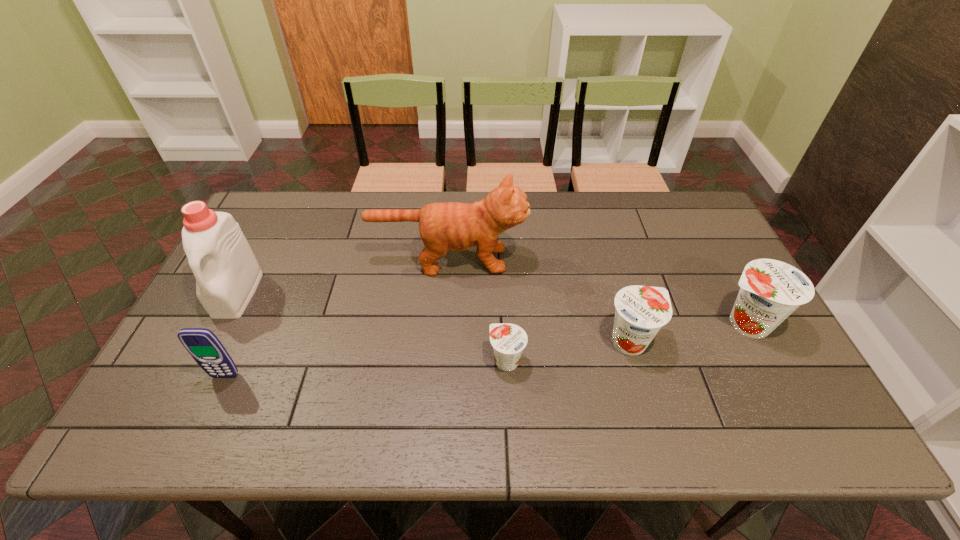
Locate an element on the screen. The height and width of the screenshot is (540, 960). unoccupied area between the cellular telephone and the detergent is located at coordinates (231, 335).

Where is `free spot between the rightmost yogurt and the detergent`? free spot between the rightmost yogurt and the detergent is located at coordinates (492, 308).

Where is `free space between the shortest yogurt and the cat`? free space between the shortest yogurt and the cat is located at coordinates (478, 310).

This screenshot has height=540, width=960. Find the location of `empty space between the rightmost object and the detergent`. empty space between the rightmost object and the detergent is located at coordinates (492, 308).

This screenshot has height=540, width=960. Identify the location of free space that is in between the cellular telephone and the rightmost yogurt. (485, 349).

Where is `the fourth closest object relative to the cellular telephone`? the fourth closest object relative to the cellular telephone is located at coordinates (641, 311).

Identify which object is the second closest to the cellular telephone. Please provide its 2D coordinates. Your answer should be formatted as a tuple, i.e. [(x, y)], where the tuple contains the x and y coordinates of a point satisfying the conditions above.

[(450, 226)]

Select which yogurt is the closest to the rightmost object. Please provide its 2D coordinates. Your answer should be formatted as a tuple, i.e. [(x, y)], where the tuple contains the x and y coordinates of a point satisfying the conditions above.

[(641, 311)]

Identify which yogurt is the nearest to the cat. Please provide its 2D coordinates. Your answer should be formatted as a tuple, i.e. [(x, y)], where the tuple contains the x and y coordinates of a point satisfying the conditions above.

[(641, 311)]

Where is `free space that satisfies the following two spatial constraints: 1. on the back side of the second object from right to left; 2. on the face of the cat`? Image resolution: width=960 pixels, height=540 pixels. free space that satisfies the following two spatial constraints: 1. on the back side of the second object from right to left; 2. on the face of the cat is located at coordinates (607, 260).